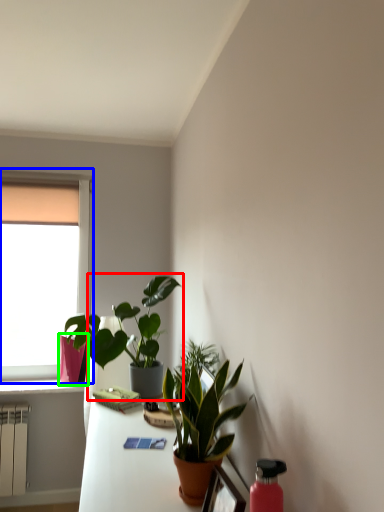
Question: Considering the real-world distances, which object is farthest from houseplant (highlighted by a red box)? window (highlighted by a blue box) or flowerpot (highlighted by a green box)?

Choices:
 (A) window
 (B) flowerpot

Answer: (A)